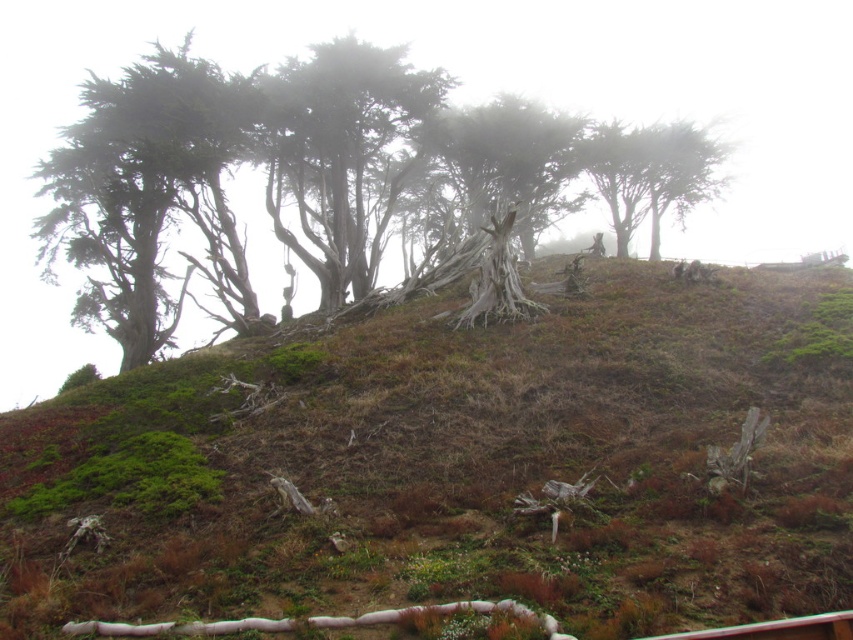
You are standing at the center of the image and want to locate the green textured tree at left. In which direction should you look to find it?

The green textured tree at left is located at the left side of the image, so you should look to your left to find it.

You are an environmental scientist assessing the terrain. You need to determine if the green mossy hillside at upper center can support the growth of the smooth gray bark trees at center. Based on their relative heights, what is your conclusion?

The green mossy hillside at upper center is shorter than the smooth gray bark trees at center, which means the trees are taller and likely overshadow the hillside. This could indicate that the hillside may not receive sufficient sunlight to support the growth of the smooth gray bark trees due to the trees already occupying the upper canopy.